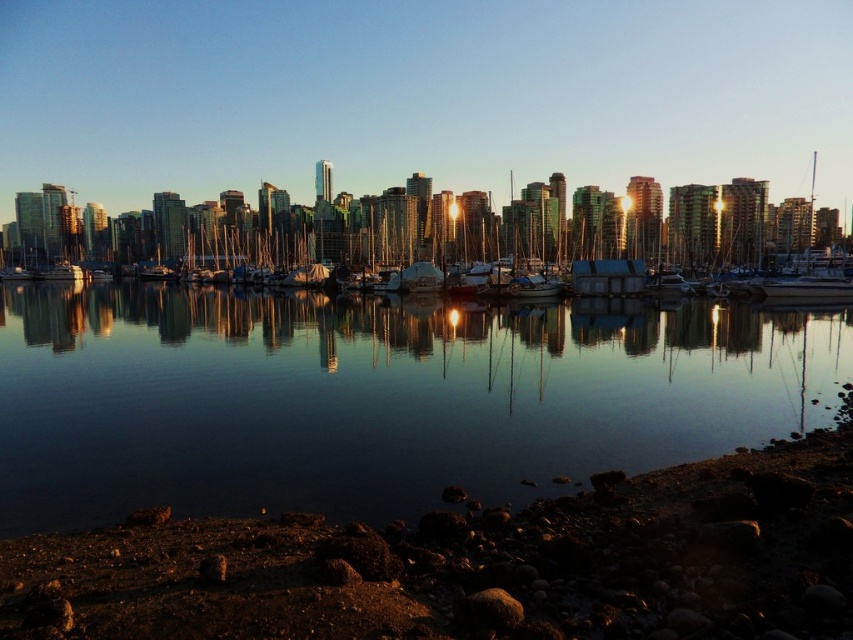
You are an architect designing a new observation deck overlooking the waterfront scene. You need to place a large window exactly at the point where the transparent glass water at center is located. What are the coordinates for placing this window?

The coordinates for placing the window should be at point (x=375, y=397) where the transparent glass water at center is located.

You are standing at the shoreline in the waterfront scene. You see a point marked at coordinates point (375, 397). What is located at that point?

The point (375, 397) corresponds to transparent glass water at center.